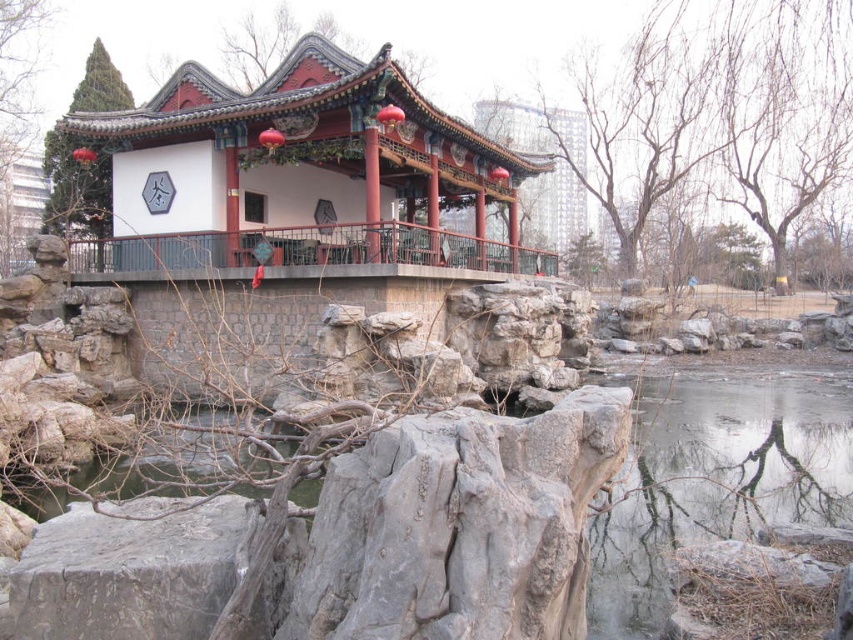
You are standing on the ground near the rocky landscape in front of the pavilion. You want to reach the hexagonal signboard displayed on the pavilion. Which object do you need to go through or climb first, the matte red gazebo at center or the rustic wood balcony at center?

The matte red gazebo at center is above the rustic wood balcony at center. To reach the hexagonal signboard displayed on the pavilion, you must first climb or go through the rustic wood balcony at center since it is below the gazebo.

You are a visitor standing at the entrance of the park and see the matte red gazebo at center and the rustic wood balcony at center. Which structure do you need to look up more to see?

The matte red gazebo at center is much taller than the rustic wood balcony at center, so you need to look up more to see the matte red gazebo at center.

You are planning to host a small gathering in the park and want to choose between the matte red gazebo at center and the rustic wood balcony at center for seating. Based on their sizes, which location can accommodate more guests?

The matte red gazebo at center has a greater width than the rustic wood balcony at center, so it can accommodate more guests.